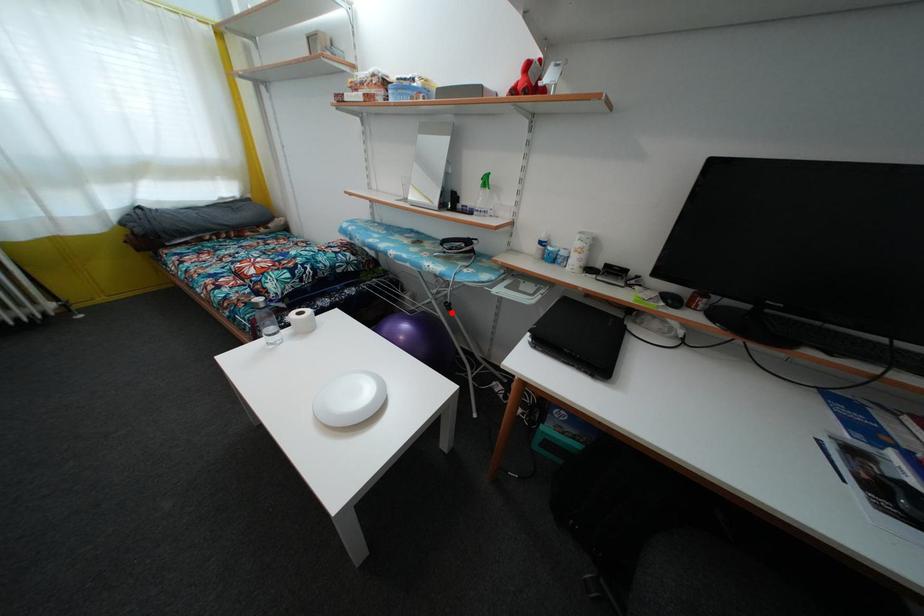
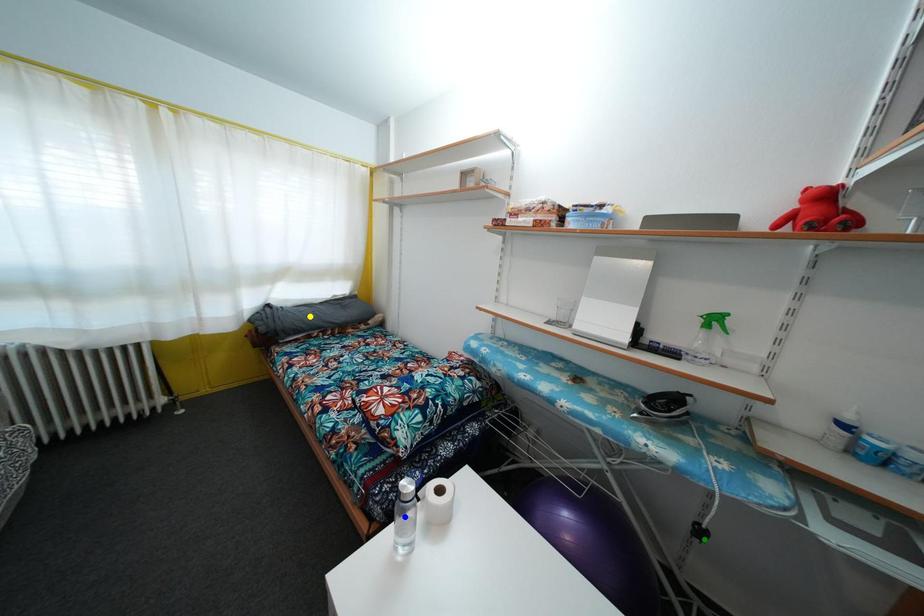
Question: I am providing you with two images of the same scene from different viewpoints. A red point is marked on the first image. You are given multiple points on the second image. Which spot in image 2 lines up with the point in image 1?

Choices:
 (A) yellow point
 (B) blue point
 (C) green point

Answer: (C)